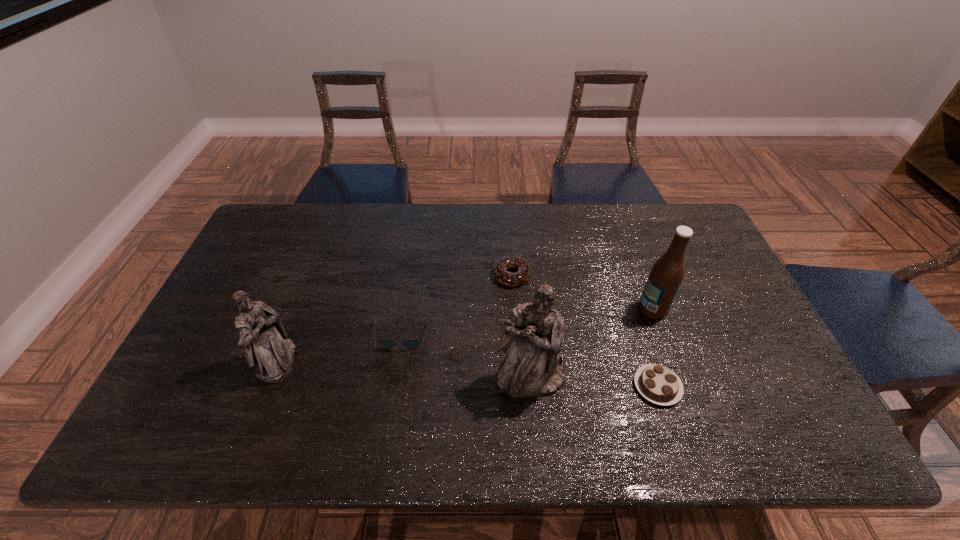
Locate an element on the screen. This screenshot has width=960, height=540. vacant space in between the doughnut and the second object from left to right is located at coordinates point(457,305).

The height and width of the screenshot is (540, 960). What are the coordinates of `free space between the right figurine and the sunglasses` in the screenshot? It's located at (467, 356).

Locate an element on the screen. free point between the taller figurine and the chocolate cake is located at coordinates (593, 382).

What are the coordinates of `free space between the taller figurine and the beer bottle` in the screenshot? It's located at (591, 343).

Locate which object is the closest to the farthest object. Please provide its 2D coordinates. Your answer should be formatted as a tuple, i.e. [(x, y)], where the tuple contains the x and y coordinates of a point satisfying the conditions above.

[(385, 343)]

Locate an element on the screen. the closest object to the shorter figurine is located at coordinates (385, 343).

Find the location of `vacant position in the image that satisfies the following two spatial constraints: 1. on the lenses of the fifth object from right to left; 2. on the front-facing side of the leftmost object`. vacant position in the image that satisfies the following two spatial constraints: 1. on the lenses of the fifth object from right to left; 2. on the front-facing side of the leftmost object is located at coordinates (398, 361).

Locate an element on the screen. This screenshot has height=540, width=960. free location that satisfies the following two spatial constraints: 1. on the back side of the chocolate cake; 2. on the front-facing side of the leftmost object is located at coordinates (650, 361).

Image resolution: width=960 pixels, height=540 pixels. What are the coordinates of `vacant space that satisfies the following two spatial constraints: 1. on the front side of the doughnut; 2. on the front-facing side of the third tallest object` in the screenshot? It's located at (518, 361).

In order to click on free space that satisfies the following two spatial constraints: 1. on the front-facing side of the right figurine; 2. on the left side of the chocolate cake in this screenshot , I will do `click(531, 386)`.